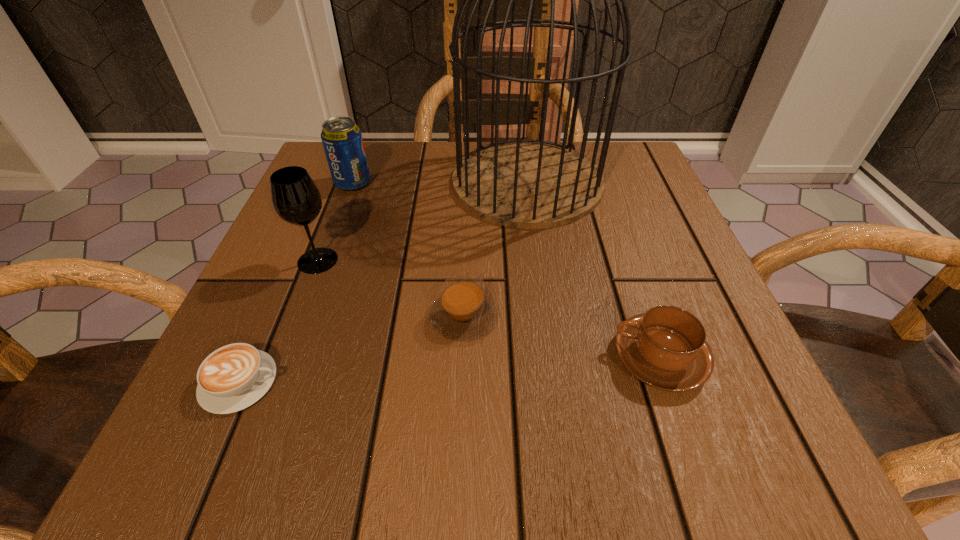
Locate an element on the screen. soda situated at the far edge is located at coordinates (342, 140).

This screenshot has height=540, width=960. I want to click on object that is positioned at the near edge, so click(233, 377).

Where is `wineglass that is at the left edge`? The width and height of the screenshot is (960, 540). wineglass that is at the left edge is located at coordinates (296, 199).

In order to click on soda at the left edge in this screenshot , I will do `click(342, 140)`.

What are the coordinates of `cappuccino present at the left edge` in the screenshot? It's located at (233, 377).

Identify the location of birdcage positioned at the right edge. The image size is (960, 540). (523, 183).

You are a GUI agent. You are given a task and a screenshot of the screen. Output one action in this format:
    pyautogui.click(x=<x>, y=<y>)
    Task: Click on the cappuccino positioned at the right edge
    The height and width of the screenshot is (540, 960).
    Given the screenshot: What is the action you would take?
    pyautogui.click(x=666, y=348)

The height and width of the screenshot is (540, 960). I want to click on object that is at the far left corner, so click(342, 140).

In order to click on object present at the near left corner in this screenshot , I will do `click(233, 377)`.

The width and height of the screenshot is (960, 540). Find the location of `object situated at the far right corner`. object situated at the far right corner is located at coordinates (523, 183).